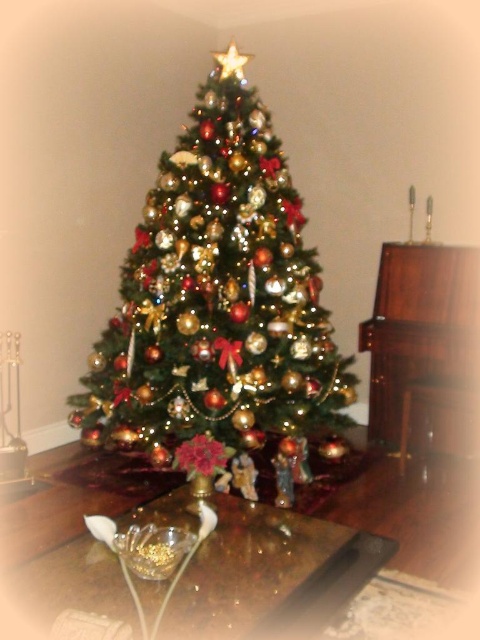
Can you confirm if shiny gold ornaments at center is thinner than transparent glass bowl at center?

No.

Who is more distant from viewer, (228, 342) or (86, 596)?

Point (228, 342)

Identify the location of shiny gold ornaments at center. This screenshot has width=480, height=640. (216, 298).